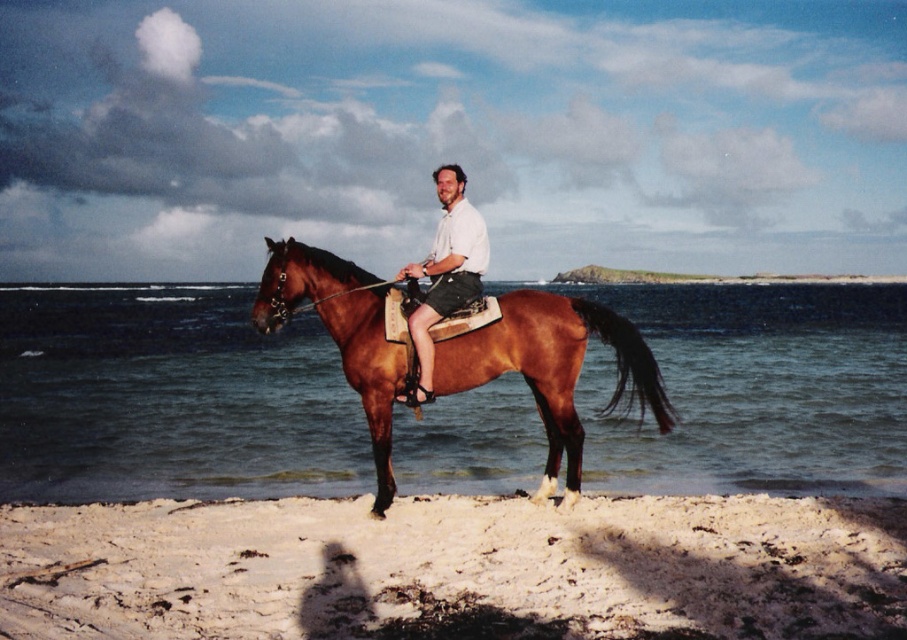
Question: Is brown glossy water at center wider than shiny brown horse at center?

Choices:
 (A) yes
 (B) no

Answer: (A)

Question: Estimate the real-world distances between objects in this image. Which object is closer to the matte white shirt at center?

Choices:
 (A) white sandy beach at lower center
 (B) shiny brown horse at center

Answer: (B)

Question: Can you confirm if white sandy beach at lower center is positioned to the left of matte white shirt at center?

Choices:
 (A) yes
 (B) no

Answer: (B)

Question: Which object appears farthest from the camera in this image?

Choices:
 (A) matte white shirt at center
 (B) brown glossy water at center

Answer: (B)

Question: Which point is farther to the camera?

Choices:
 (A) matte white shirt at center
 (B) brown glossy water at center
 (C) white sandy beach at lower center
 (D) shiny brown horse at center

Answer: (B)

Question: Does shiny brown horse at center lie behind matte white shirt at center?

Choices:
 (A) no
 (B) yes

Answer: (A)